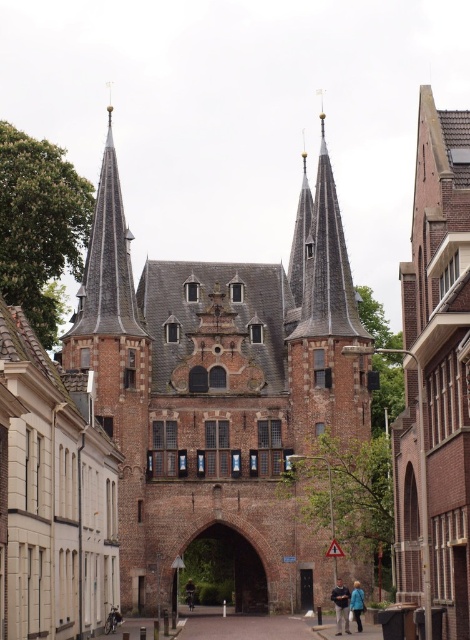
Question: Is smooth gray spire at center to the left of blue fabric jacket at center from the viewer's perspective?

Choices:
 (A) no
 (B) yes

Answer: (B)

Question: Among these points, which one is farthest from the camera?

Choices:
 (A) (296, 257)
 (B) (347, 632)
 (C) (363, 605)
 (D) (397, 496)

Answer: (A)

Question: Which point is farther to the camera?

Choices:
 (A) (441, 163)
 (B) (312, 548)
 (C) (192, 582)

Answer: (C)

Question: Which object appears farthest from the camera in this image?

Choices:
 (A) smooth gray spire at center
 (B) light brown leather jacket at center

Answer: (B)

Question: Observing the image, what is the correct spatial positioning of brown brick church at center in reference to light brown leather jacket at center?

Choices:
 (A) above
 (B) below

Answer: (A)

Question: Does smooth gray spire at center come in front of light brown leather jacket at center?

Choices:
 (A) no
 (B) yes

Answer: (B)